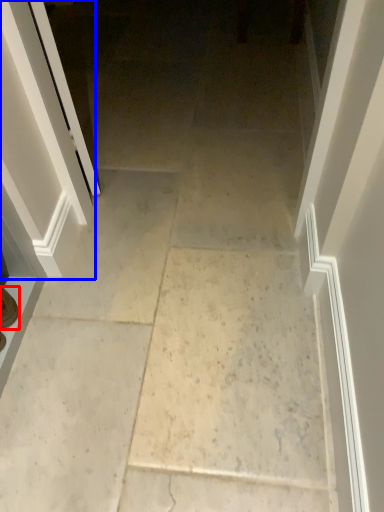
Question: Which of the following is the farthest to the observer, footwear (highlighted by a red box) or screen door (highlighted by a blue box)?

Choices:
 (A) footwear
 (B) screen door

Answer: (A)